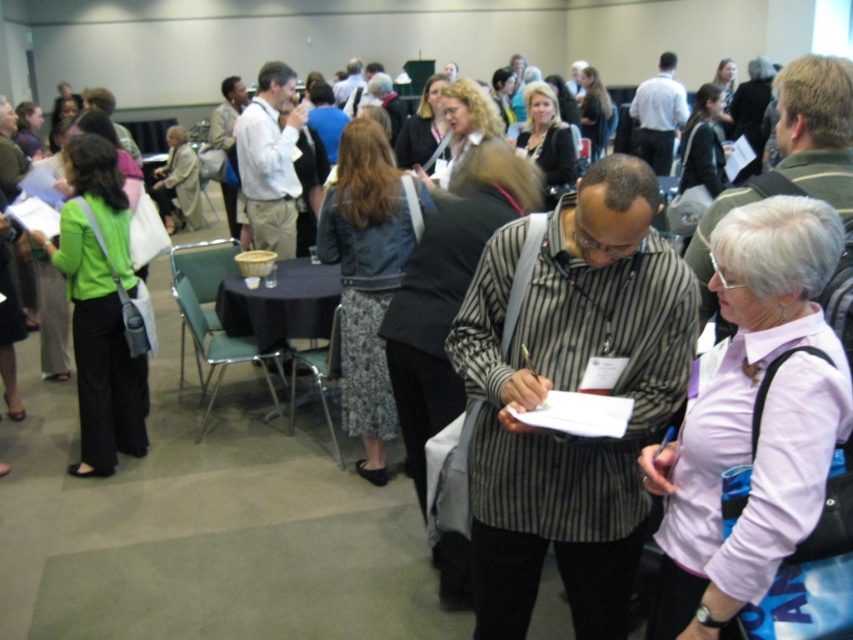
Is striped shirt at center bigger than white shirt at center?

Actually, striped shirt at center might be smaller than white shirt at center.

This screenshot has width=853, height=640. Identify the location of striped shirt at center. (816, 128).

Can you confirm if striped cotton shirt at center is positioned to the right of white shirt at center?

Incorrect, striped cotton shirt at center is not on the right side of white shirt at center.

Which is above, striped cotton shirt at center or white shirt at center?

Positioned higher is white shirt at center.

From the picture: Who is more distant from viewer, (630, 515) or (645, 88)?

Positioned behind is point (645, 88).

Locate an element on the screen. The height and width of the screenshot is (640, 853). striped cotton shirt at center is located at coordinates (570, 388).

Who is shorter, light beige cotton shirt at center or white shirt at center?

light beige cotton shirt at center is shorter.

Which is more to the right, light beige cotton shirt at center or white shirt at center?

From the viewer's perspective, white shirt at center appears more on the right side.

Describe the element at coordinates (270, 161) in the screenshot. I see `light beige cotton shirt at center` at that location.

The width and height of the screenshot is (853, 640). I want to click on light beige cotton shirt at center, so pyautogui.click(x=270, y=161).